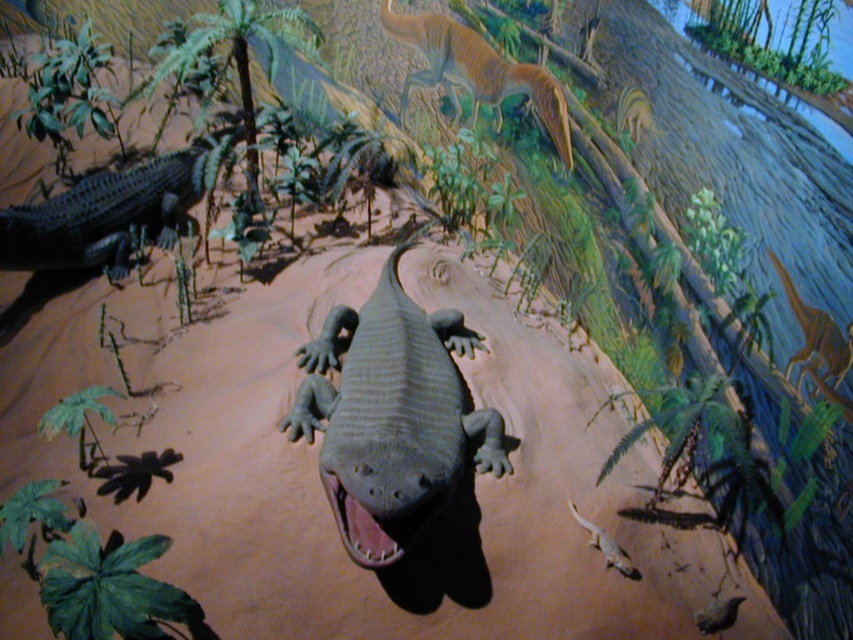
You are standing at the point marked by coordinates point (604,545) in the diorama. What creature do you see directly in front of you?

The point (604,545) indicates smooth beige lizard at lower center, so you would see the smooth beige lizard at lower center directly in front of you.

You are standing at the point with coordinates point (830, 346) in the prehistoric diorama scene. You want to move towards the point with coordinates point (387, 422). Is the path between these two points clear of any obstacles?

Point (387, 422) is behind point (830, 346), so the path between them might be blocked by the large crocodile like creature in the foreground. You may need to navigate around it.